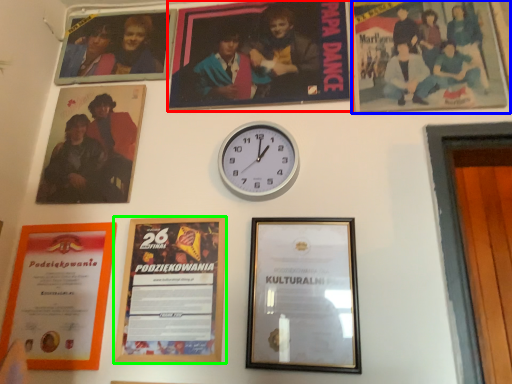
Question: Which is nearer to the picture frame (highlighted by a red box)? picture frame (highlighted by a blue box) or picture frame (highlighted by a green box).

Choices:
 (A) picture frame
 (B) picture frame

Answer: (A)